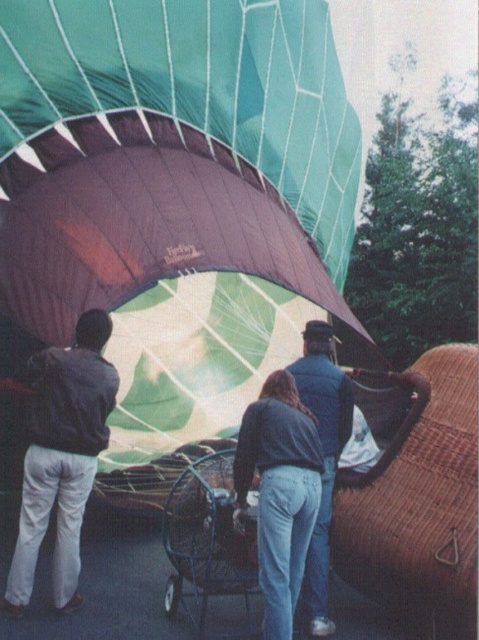
Question: Can you confirm if denim jacket at center is smaller than metallic silver baby carriage at center?

Choices:
 (A) yes
 (B) no

Answer: (B)

Question: Which object is closer to the camera taking this photo?

Choices:
 (A) denim jacket at center
 (B) dark blue jacket at left
 (C) metallic silver baby carriage at center

Answer: (A)

Question: Which point is closer to the camera taking this photo?

Choices:
 (A) (342, 417)
 (B) (219, 566)
 (C) (53, 397)

Answer: (C)

Question: Does denim jacket at center have a larger size compared to dark blue jacket at left?

Choices:
 (A) no
 (B) yes

Answer: (B)

Question: Can you confirm if denim jacket at center is positioned below metallic silver baby carriage at center?

Choices:
 (A) no
 (B) yes

Answer: (A)

Question: Which point is farther to the camera?

Choices:
 (A) metallic silver baby carriage at center
 (B) dark blue jacket at left

Answer: (B)